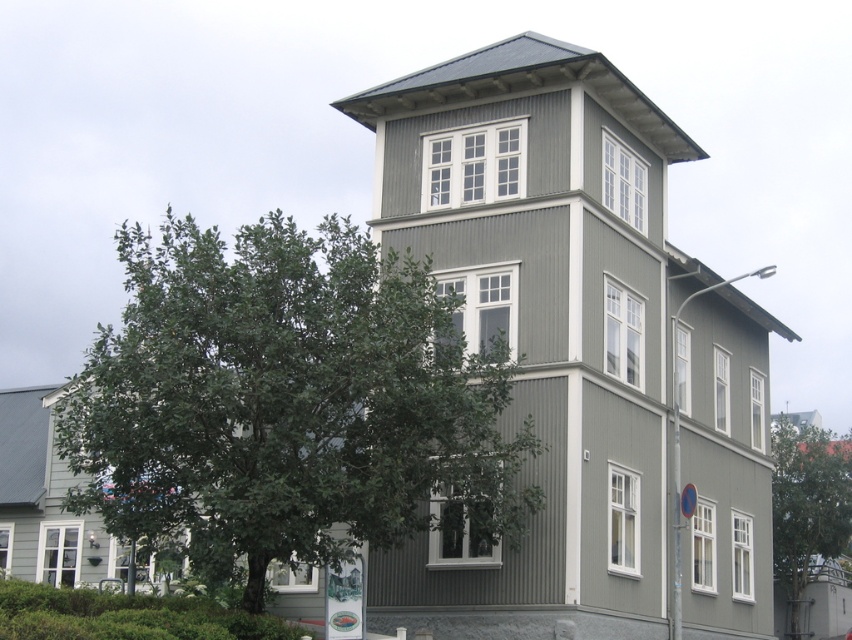
Question: Which point is farther from the camera taking this photo?

Choices:
 (A) (407, 108)
 (B) (353, 433)

Answer: (A)

Question: Which point is farther to the camera?

Choices:
 (A) green leafy tree at left
 (B) matte gray siding at center
 (C) green leafy tree at lower right

Answer: (C)

Question: Does matte gray siding at center come behind green leafy tree at left?

Choices:
 (A) yes
 (B) no

Answer: (A)

Question: Which object appears farthest from the camera in this image?

Choices:
 (A) matte gray siding at center
 (B) green leafy tree at lower right

Answer: (B)

Question: Does matte gray siding at center appear on the left side of green leafy tree at lower right?

Choices:
 (A) no
 (B) yes

Answer: (B)

Question: Does green leafy tree at left have a smaller size compared to green leafy tree at lower right?

Choices:
 (A) no
 (B) yes

Answer: (A)